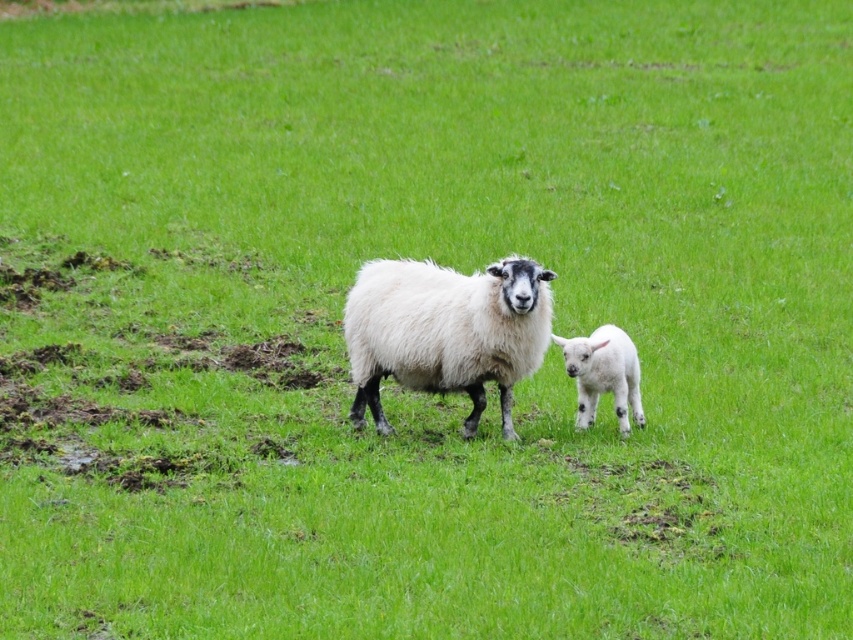
Which is more to the left, white woolly sheep at center or white fluffy lamb at right?

white woolly sheep at center is more to the left.

Is white woolly sheep at center above white fluffy lamb at right?

Yes.

Is point (482, 387) closer to camera compared to point (627, 352)?

Yes, point (482, 387) is closer to viewer.

Find the location of a particular element. white woolly sheep at center is located at coordinates (445, 332).